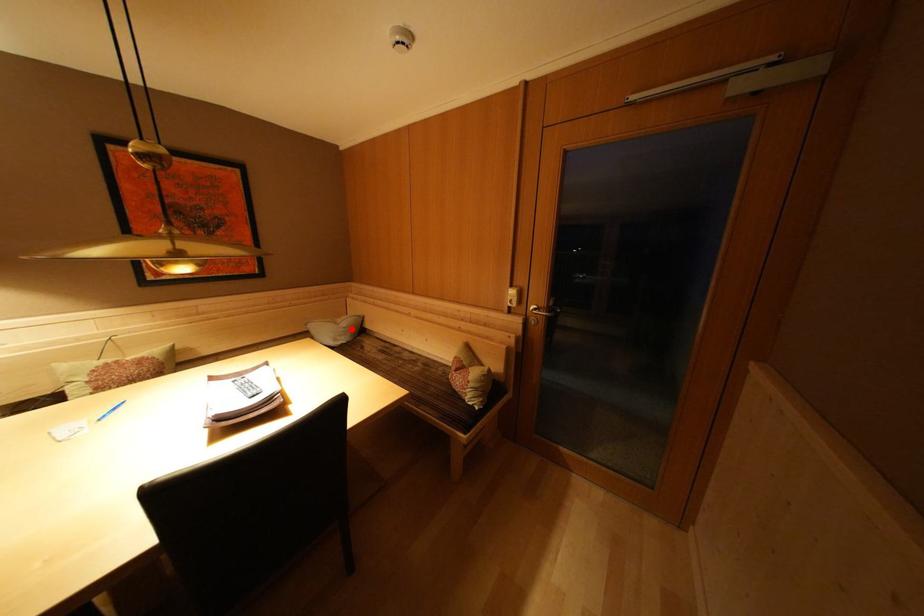
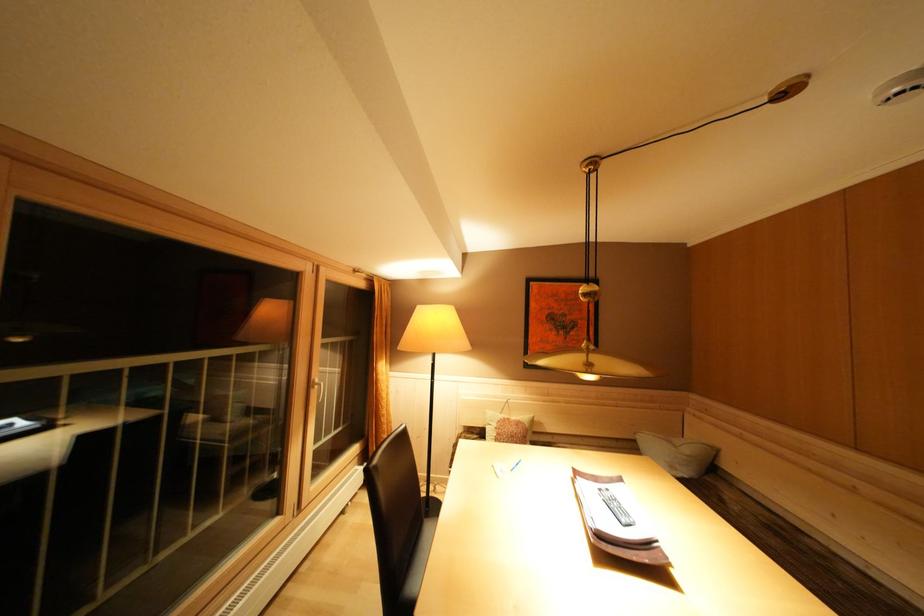
Question: I am providing you with two images of the same scene from different viewpoints. In image1, a red point is highlighted. Considering the same 3D point in image2, which of the following is correct?

Choices:
 (A) It is closer
 (B) It is farther

Answer: (B)